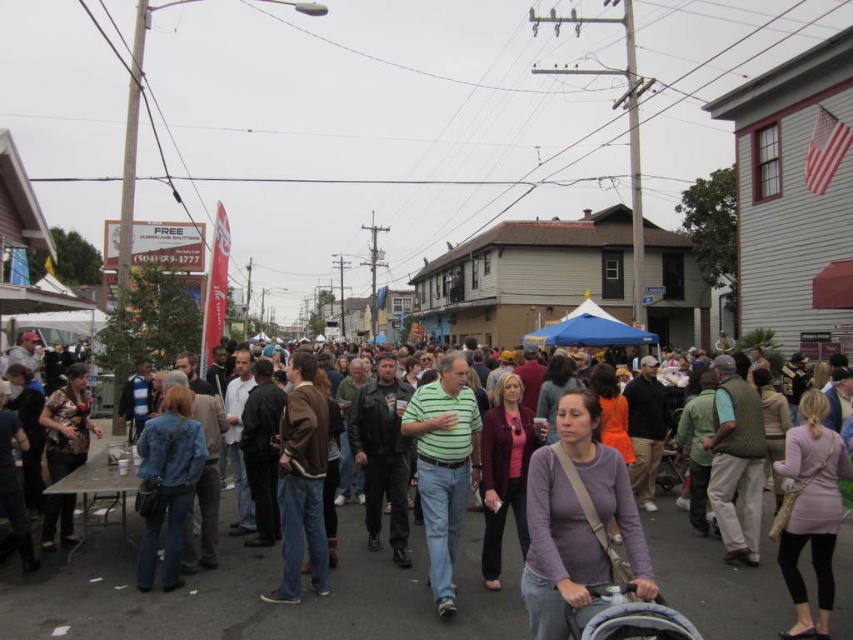
Is point (578, 577) positioned in front of point (410, 403)?

Yes, point (578, 577) is closer to viewer.

Describe the element at coordinates (578, 522) in the screenshot. The height and width of the screenshot is (640, 853). I see `purple matte sweater at center` at that location.

Find the location of a particular element. The width and height of the screenshot is (853, 640). purple matte sweater at center is located at coordinates (578, 522).

Is green striped shirt at center smaller than gray fabric baby carriage at lower right?

Incorrect, green striped shirt at center is not smaller in size than gray fabric baby carriage at lower right.

Is green striped shirt at center thinner than gray fabric baby carriage at lower right?

No.

Locate an element on the screen. green striped shirt at center is located at coordinates (444, 465).

Who is positioned more to the right, matte black stroller at center or green striped shirt at center?

From the viewer's perspective, matte black stroller at center appears more on the right side.

This screenshot has width=853, height=640. What do you see at coordinates (257, 596) in the screenshot?
I see `matte black stroller at center` at bounding box center [257, 596].

Is point (329, 608) in front of point (439, 474)?

Yes, point (329, 608) is closer to viewer.

This screenshot has height=640, width=853. Identify the location of matte black stroller at center. (257, 596).